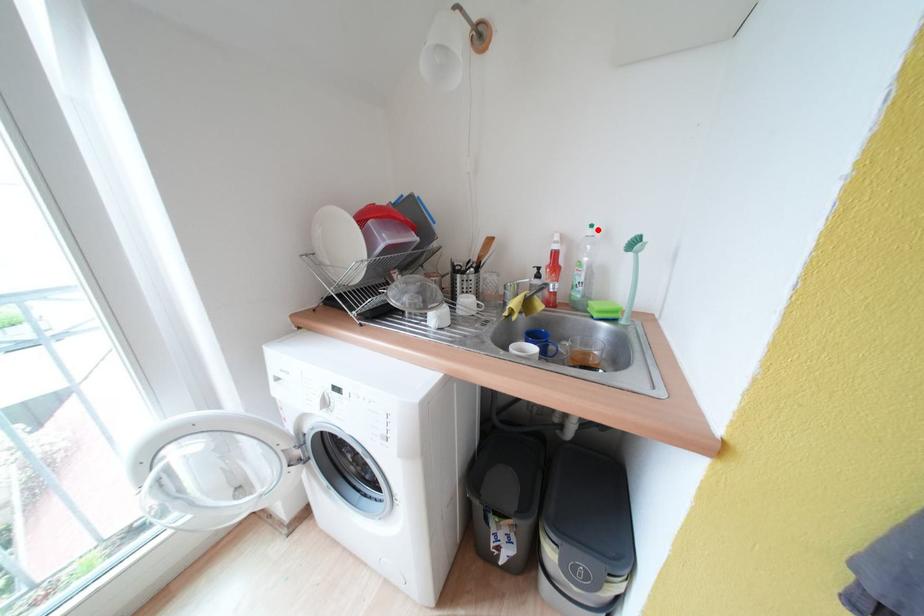
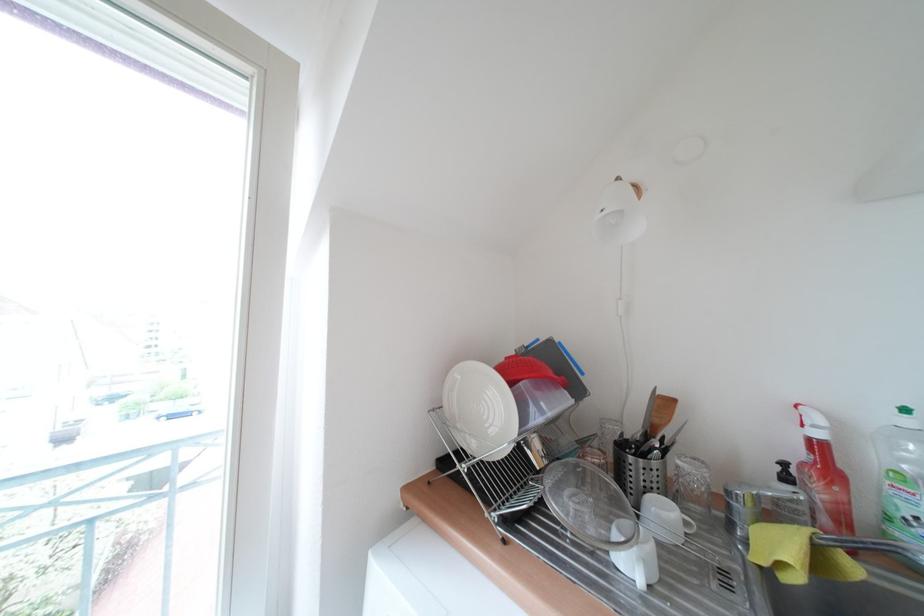
The point at the highlighted location is marked in the first image. Where is the corresponding point in the second image?

(912, 413)